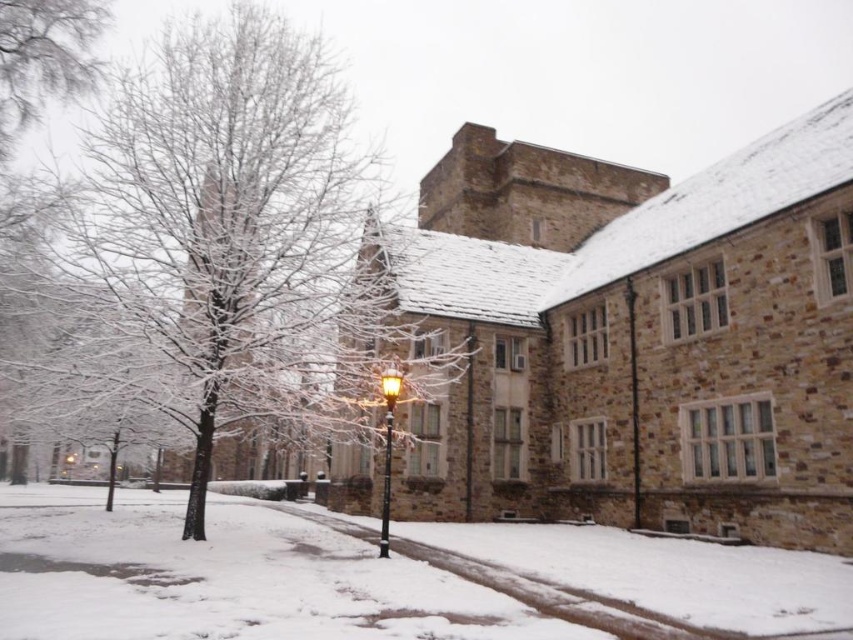
Is white powdery snow at center taller than matte black lamp post at center?

No.

Does white powdery snow at center have a smaller size compared to matte black lamp post at center?

No.

Is point (413, 536) less distant than point (384, 531)?

No, (413, 536) is behind (384, 531).

Identify the location of white powdery snow at center. Image resolution: width=853 pixels, height=640 pixels. (375, 576).

Image resolution: width=853 pixels, height=640 pixels. What do you see at coordinates (225, 256) in the screenshot?
I see `snow-covered tree at center-left` at bounding box center [225, 256].

Based on the photo, does snow-covered tree at center-left have a lesser width compared to white powdery snow at center?

Yes, snow-covered tree at center-left is thinner than white powdery snow at center.

Who is more forward, (305, 412) or (422, 637)?

Point (422, 637) is more forward.

In order to click on snow-covered tree at center-left in this screenshot , I will do `click(225, 256)`.

Which is behind, point (300, 170) or point (0, 29)?

Point (0, 29)

Is point (106, 160) positioned after point (97, 28)?

No.

Is point (103, 326) less distant than point (54, 35)?

That is True.

Locate an element on the screen. Image resolution: width=853 pixels, height=640 pixels. snow-covered tree at center-left is located at coordinates (225, 256).